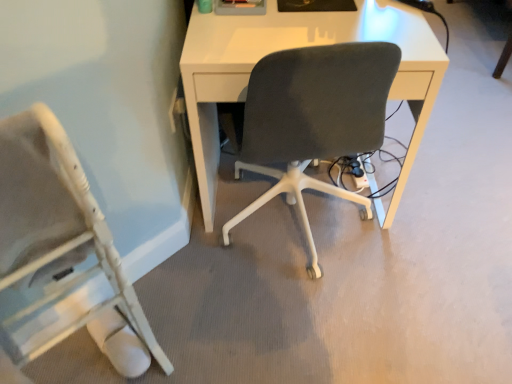
Identify the location of free space in front of white matte desk at center. (310, 323).